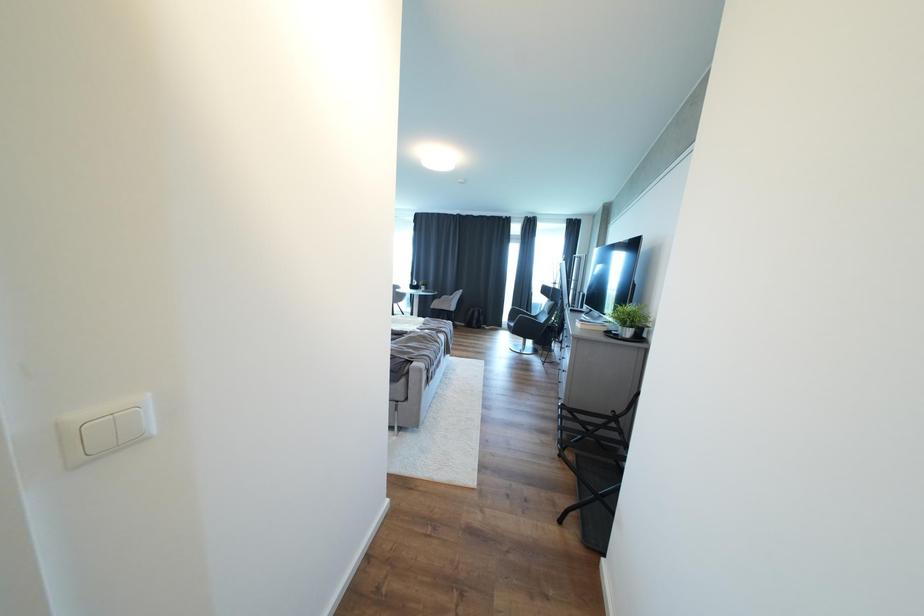
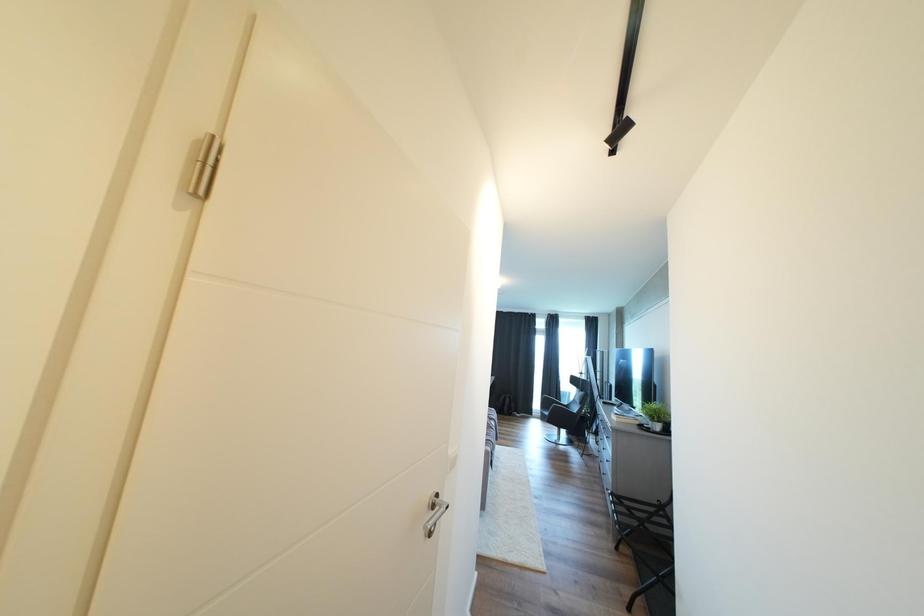
Question: Based on the continuous images, in which direction is the camera rotating? Reply with the corresponding letter.

Choices:
 (A) Left
 (B) Right
 (C) Up
 (D) Down

Answer: (C)